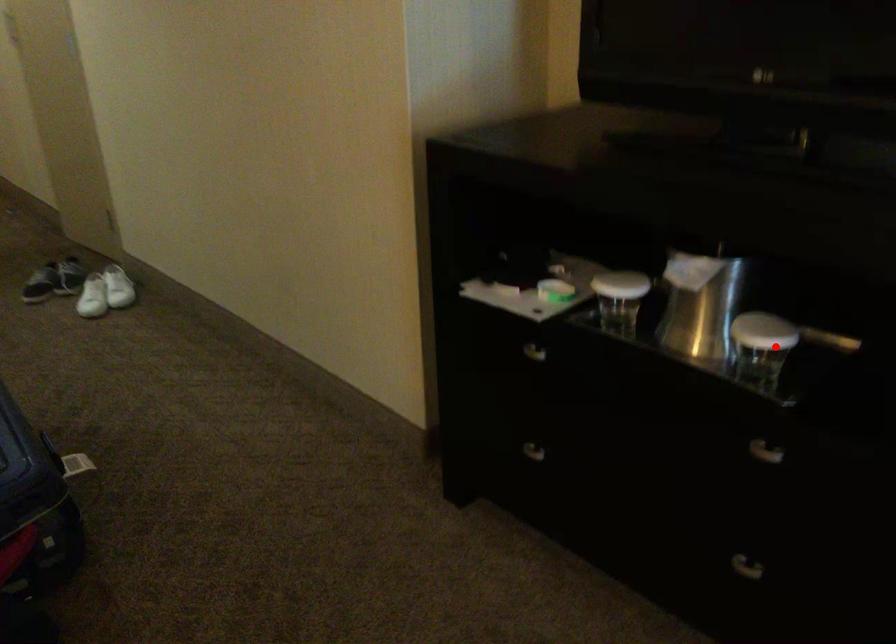
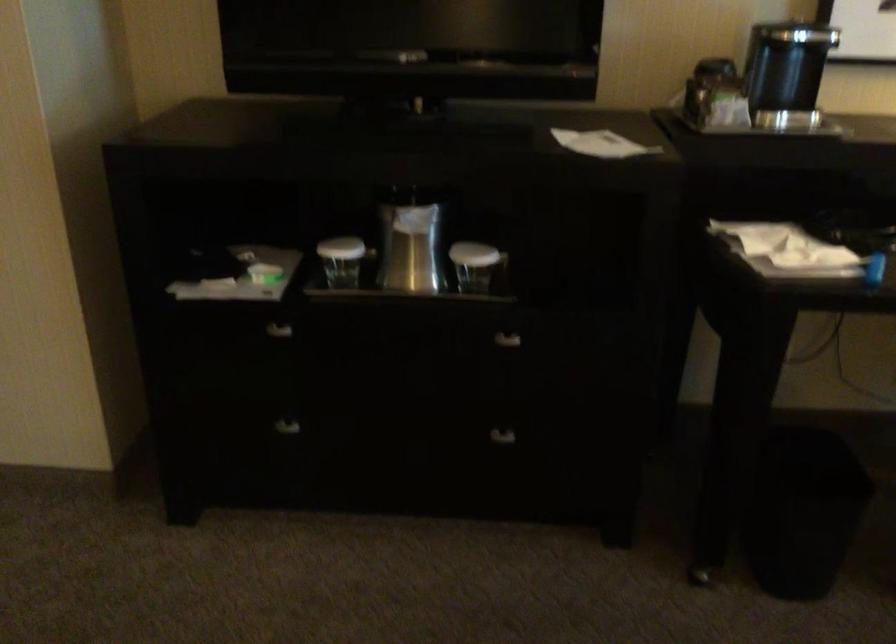
The point at the highlighted location is marked in the first image. Where is the corresponding point in the second image?

(479, 268)